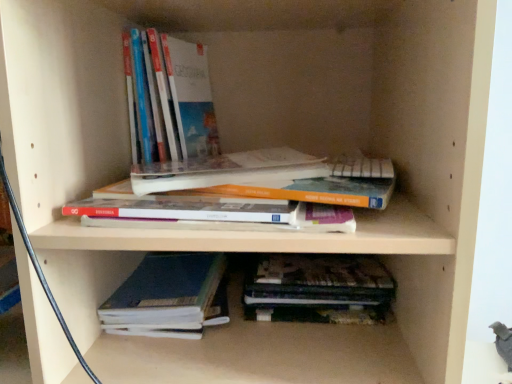
The width and height of the screenshot is (512, 384). I want to click on dark brown leather book at lower center, which is counted as the second book, starting from the bottom, so click(318, 288).

What do you see at coordinates (243, 193) in the screenshot? This screenshot has height=384, width=512. I see `hardcover book at center, positioned as the 3th book in bottom-to-top order` at bounding box center [243, 193].

What do you see at coordinates (168, 297) in the screenshot? This screenshot has height=384, width=512. I see `dark blue hardcover book at lower center, marked as the 1th book in a bottom-to-top arrangement` at bounding box center [168, 297].

You are a GUI agent. You are given a task and a screenshot of the screen. Output one action in this format:
    pyautogui.click(x=<x>, y=<y>)
    Task: Click on the dark brown leather book at lower center, which appears as the 3th book when viewed from the top
    
    Given the screenshot: What is the action you would take?
    pyautogui.click(x=318, y=288)

Which is correct: dark brown leather book at lower center, which appears as the 3th book when viewed from the top, is inside hardcover book at center, positioned as the 3th book in bottom-to-top order, or outside of it?

dark brown leather book at lower center, which appears as the 3th book when viewed from the top, lies outside hardcover book at center, positioned as the 3th book in bottom-to-top order.

Considering the sizes of objects dark brown leather book at lower center, which appears as the 3th book when viewed from the top, and hardcover book at center, positioned as the 3th book in bottom-to-top order, in the image provided, who is smaller, dark brown leather book at lower center, which appears as the 3th book when viewed from the top, or hardcover book at center, positioned as the 3th book in bottom-to-top order,?

dark brown leather book at lower center, which appears as the 3th book when viewed from the top.

From a real-world perspective, is dark brown leather book at lower center, which appears as the 3th book when viewed from the top, positioned over hardcover book at center, the 2th book when ordered from top to bottom, based on gravity?

No, from a real-world perspective, dark brown leather book at lower center, which appears as the 3th book when viewed from the top, is not over hardcover book at center, the 2th book when ordered from top to bottom

There is a dark blue hardcover book at lower center, the fourth book from the top. Where is `the 2nd book above it (from the image's perspective)`? This screenshot has width=512, height=384. the 2nd book above it (from the image's perspective) is located at coordinates (243, 193).

Considering the sizes of objects hardcover book at center, positioned as the 3th book in bottom-to-top order, and dark blue hardcover book at lower center, marked as the 1th book in a bottom-to-top arrangement, in the image provided, who is smaller, hardcover book at center, positioned as the 3th book in bottom-to-top order, or dark blue hardcover book at lower center, marked as the 1th book in a bottom-to-top arrangement,?

dark blue hardcover book at lower center, marked as the 1th book in a bottom-to-top arrangement.

Which is nearer, (194,177) or (130,283)?

Point (194,177) is positioned closer to the camera compared to point (130,283).

Consider the image. Looking at the image, does hardcover book at upper left, which appears as the 4th book when ordered from the bottom, seem bigger or smaller compared to dark blue hardcover book at lower center, marked as the 1th book in a bottom-to-top arrangement?

hardcover book at upper left, which appears as the 4th book when ordered from the bottom, is bigger than dark blue hardcover book at lower center, marked as the 1th book in a bottom-to-top arrangement.

Could dark blue hardcover book at lower center, marked as the 1th book in a bottom-to-top arrangement, be considered to be inside hardcover book at upper left, which is the 1th book from top to bottom?

That's incorrect, dark blue hardcover book at lower center, marked as the 1th book in a bottom-to-top arrangement, is not inside hardcover book at upper left, which is the 1th book from top to bottom.

In the scene shown: Is hardcover book at upper left, which appears as the 4th book when ordered from the bottom, aimed at dark blue hardcover book at lower center, marked as the 1th book in a bottom-to-top arrangement?

No, hardcover book at upper left, which appears as the 4th book when ordered from the bottom, is not aimed at dark blue hardcover book at lower center, marked as the 1th book in a bottom-to-top arrangement.

Can you confirm if hardcover book at upper left, which appears as the 4th book when ordered from the bottom, is positioned to the right of dark blue hardcover book at lower center, marked as the 1th book in a bottom-to-top arrangement?

No, hardcover book at upper left, which appears as the 4th book when ordered from the bottom, is not to the right of dark blue hardcover book at lower center, marked as the 1th book in a bottom-to-top arrangement.

Is dark blue hardcover book at lower center, marked as the 1th book in a bottom-to-top arrangement, far from hardcover book at center, positioned as the 3th book in bottom-to-top order?

No, dark blue hardcover book at lower center, marked as the 1th book in a bottom-to-top arrangement, is in close proximity to hardcover book at center, positioned as the 3th book in bottom-to-top order.

Where is `the 1st book counting from the right side of the dark blue hardcover book at lower center, the fourth book from the top`? the 1st book counting from the right side of the dark blue hardcover book at lower center, the fourth book from the top is located at coordinates (243, 193).

Considering the positions of points (208, 253) and (185, 179), is point (208, 253) closer to camera compared to point (185, 179)?

No, (208, 253) is behind (185, 179).

Does dark blue hardcover book at lower center, the fourth book from the top, have a larger size compared to hardcover book at center, the 2th book when ordered from top to bottom?

No, dark blue hardcover book at lower center, the fourth book from the top, is not bigger than hardcover book at center, the 2th book when ordered from top to bottom.

Is hardcover book at center, the 2th book when ordered from top to bottom, oriented towards hardcover book at upper left, which appears as the 4th book when ordered from the bottom?

No, hardcover book at center, the 2th book when ordered from top to bottom, does not turn towards hardcover book at upper left, which appears as the 4th book when ordered from the bottom.

Does hardcover book at center, the 2th book when ordered from top to bottom, appear on the left side of hardcover book at upper left, which appears as the 4th book when ordered from the bottom?

No, hardcover book at center, the 2th book when ordered from top to bottom, is not to the left of hardcover book at upper left, which appears as the 4th book when ordered from the bottom.

At what (x,y) coordinates should I click in order to perform the action: click on the 1st book located beneath the hardcover book at upper left, which is the 1th book from top to bottom (from a real-world perspective). Please return your answer as a coordinate pair (x, y). Looking at the image, I should click on (243, 193).

How distant is hardcover book at center, the 2th book when ordered from top to bottom, from hardcover book at upper left, which is the 1th book from top to bottom?

7.64 inches.

Between hardcover book at upper left, which is the 1th book from top to bottom, and dark brown leather book at lower center, which is counted as the second book, starting from the bottom, which one has larger size?

Bigger between the two is hardcover book at upper left, which is the 1th book from top to bottom.

Is hardcover book at upper left, which appears as the 4th book when ordered from the bottom, thinner than dark brown leather book at lower center, which appears as the 3th book when viewed from the top?

No, hardcover book at upper left, which appears as the 4th book when ordered from the bottom, is not thinner than dark brown leather book at lower center, which appears as the 3th book when viewed from the top.

Is dark brown leather book at lower center, which appears as the 3th book when viewed from the top, completely or partially inside hardcover book at upper left, which is the 1th book from top to bottom?

No, dark brown leather book at lower center, which appears as the 3th book when viewed from the top, is not inside hardcover book at upper left, which is the 1th book from top to bottom.

Considering the relative positions of hardcover book at upper left, which appears as the 4th book when ordered from the bottom, and dark brown leather book at lower center, which appears as the 3th book when viewed from the top, in the image provided, is hardcover book at upper left, which appears as the 4th book when ordered from the bottom, to the right of dark brown leather book at lower center, which appears as the 3th book when viewed from the top, from the viewer's perspective?

Incorrect, hardcover book at upper left, which appears as the 4th book when ordered from the bottom, is not on the right side of dark brown leather book at lower center, which appears as the 3th book when viewed from the top.

Which object is positioned more to the left, dark blue hardcover book at lower center, the fourth book from the top, or dark brown leather book at lower center, which appears as the 3th book when viewed from the top?

dark blue hardcover book at lower center, the fourth book from the top.

Is dark blue hardcover book at lower center, the fourth book from the top, wider than dark brown leather book at lower center, which is counted as the second book, starting from the bottom?

Correct, the width of dark blue hardcover book at lower center, the fourth book from the top, exceeds that of dark brown leather book at lower center, which is counted as the second book, starting from the bottom.

What are the coordinates of `the 2nd book counting from the right of the dark blue hardcover book at lower center, marked as the 1th book in a bottom-to-top arrangement` in the screenshot? It's located at (318, 288).

The image size is (512, 384). In order to click on the 2nd book in front of the dark brown leather book at lower center, which appears as the 3th book when viewed from the top, starting your count from the anchor in this screenshot , I will do `click(243, 193)`.

Where is `the 1st book to the left of the hardcover book at center, the 2th book when ordered from top to bottom, counting from the anchor's position`? The height and width of the screenshot is (384, 512). the 1st book to the left of the hardcover book at center, the 2th book when ordered from top to bottom, counting from the anchor's position is located at coordinates (168, 297).

Estimate the real-world distances between objects in this image. Which object is closer to dark brown leather book at lower center, which appears as the 3th book when viewed from the top, hardcover book at center, the 2th book when ordered from top to bottom, or dark blue hardcover book at lower center, the fourth book from the top?

dark blue hardcover book at lower center, the fourth book from the top, is closer to dark brown leather book at lower center, which appears as the 3th book when viewed from the top.

From the image, which object appears to be nearer to dark brown leather book at lower center, which is counted as the second book, starting from the bottom, dark blue hardcover book at lower center, marked as the 1th book in a bottom-to-top arrangement, or hardcover book at upper left, which is the 1th book from top to bottom?

Based on the image, dark blue hardcover book at lower center, marked as the 1th book in a bottom-to-top arrangement, appears to be nearer to dark brown leather book at lower center, which is counted as the second book, starting from the bottom.

Which object lies nearer to the anchor point hardcover book at center, the 2th book when ordered from top to bottom, hardcover book at upper left, which appears as the 4th book when ordered from the bottom, or dark brown leather book at lower center, which appears as the 3th book when viewed from the top?

The object closer to hardcover book at center, the 2th book when ordered from top to bottom, is hardcover book at upper left, which appears as the 4th book when ordered from the bottom.

When comparing their distances from hardcover book at center, the 2th book when ordered from top to bottom, does dark blue hardcover book at lower center, the fourth book from the top, or dark brown leather book at lower center, which appears as the 3th book when viewed from the top, seem closer?

dark brown leather book at lower center, which appears as the 3th book when viewed from the top.

Which object lies further to the anchor point hardcover book at center, positioned as the 3th book in bottom-to-top order, dark brown leather book at lower center, which appears as the 3th book when viewed from the top, or dark blue hardcover book at lower center, the fourth book from the top?

dark blue hardcover book at lower center, the fourth book from the top, is further to hardcover book at center, positioned as the 3th book in bottom-to-top order.

Considering their positions, is hardcover book at upper left, which appears as the 4th book when ordered from the bottom, positioned further to dark brown leather book at lower center, which is counted as the second book, starting from the bottom, than hardcover book at center, positioned as the 3th book in bottom-to-top order?

hardcover book at upper left, which appears as the 4th book when ordered from the bottom, is further to dark brown leather book at lower center, which is counted as the second book, starting from the bottom.

Estimate the real-world distances between objects in this image. Which object is closer to dark blue hardcover book at lower center, the fourth book from the top, hardcover book at center, the 2th book when ordered from top to bottom, or hardcover book at upper left, which is the 1th book from top to bottom?

The object closer to dark blue hardcover book at lower center, the fourth book from the top, is hardcover book at center, the 2th book when ordered from top to bottom.

Estimate the real-world distances between objects in this image. Which object is closer to dark brown leather book at lower center, which appears as the 3th book when viewed from the top, hardcover book at upper left, which appears as the 4th book when ordered from the bottom, or dark blue hardcover book at lower center, the fourth book from the top?

dark blue hardcover book at lower center, the fourth book from the top, is closer to dark brown leather book at lower center, which appears as the 3th book when viewed from the top.

Locate an element on the screen. Image resolution: width=512 pixels, height=384 pixels. book between hardcover book at upper left, which is the 1th book from top to bottom, and dark brown leather book at lower center, which is counted as the second book, starting from the bottom, in the vertical direction is located at coordinates (243, 193).

You are a GUI agent. You are given a task and a screenshot of the screen. Output one action in this format:
    pyautogui.click(x=<x>, y=<y>)
    Task: Click on the book between hardcover book at center, positioned as the 3th book in bottom-to-top order, and dark brown leather book at lower center, which appears as the 3th book when viewed from the top, from front to back
    Image resolution: width=512 pixels, height=384 pixels.
    Given the screenshot: What is the action you would take?
    pyautogui.click(x=168, y=297)